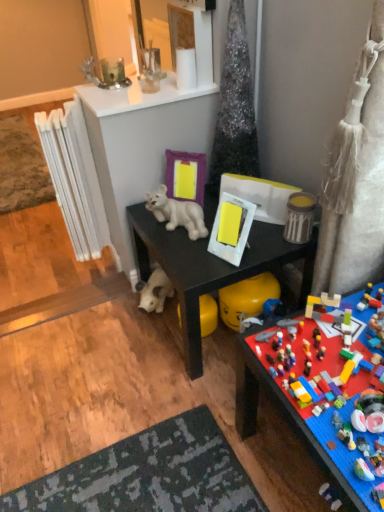
This screenshot has width=384, height=512. What are the coordinates of `free space in front of green glass candle at upper center, the 1th toy viewed from the top` in the screenshot? It's located at (119, 95).